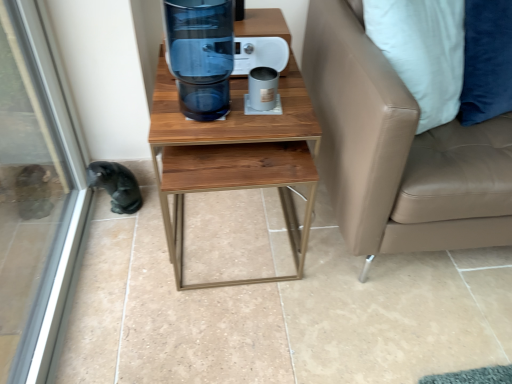
This screenshot has width=512, height=384. I want to click on free location in front of transparent glass water cooler at center, so click(x=198, y=130).